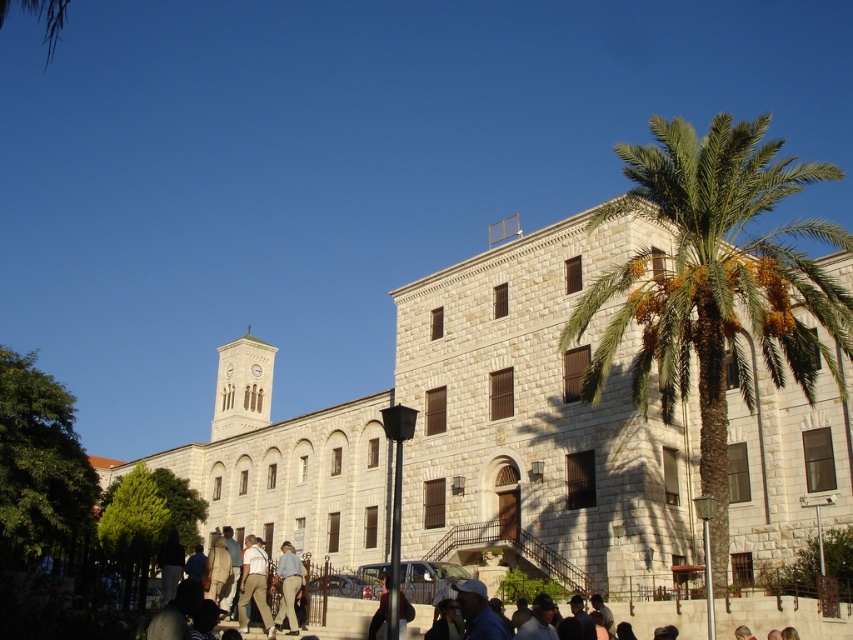
Does white stone church at center have a greater height compared to green leafy palm at center?

No, white stone church at center is not taller than green leafy palm at center.

Is point (664, 456) farther from viewer compared to point (706, 340)?

Yes, point (664, 456) is behind point (706, 340).

Is point (569, 417) farther from viewer compared to point (682, 145)?

Yes, point (569, 417) is behind point (682, 145).

The height and width of the screenshot is (640, 853). I want to click on white stone church at center, so click(469, 436).